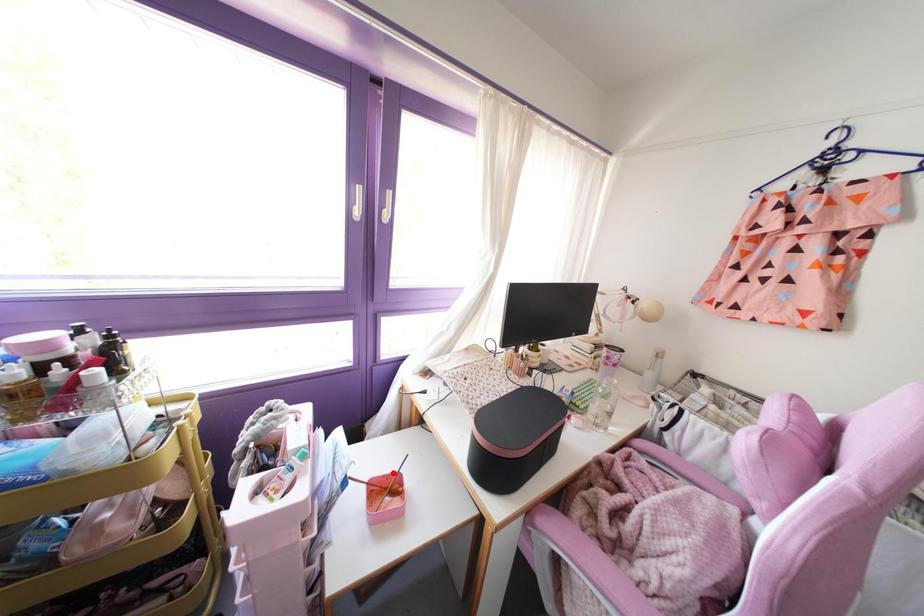
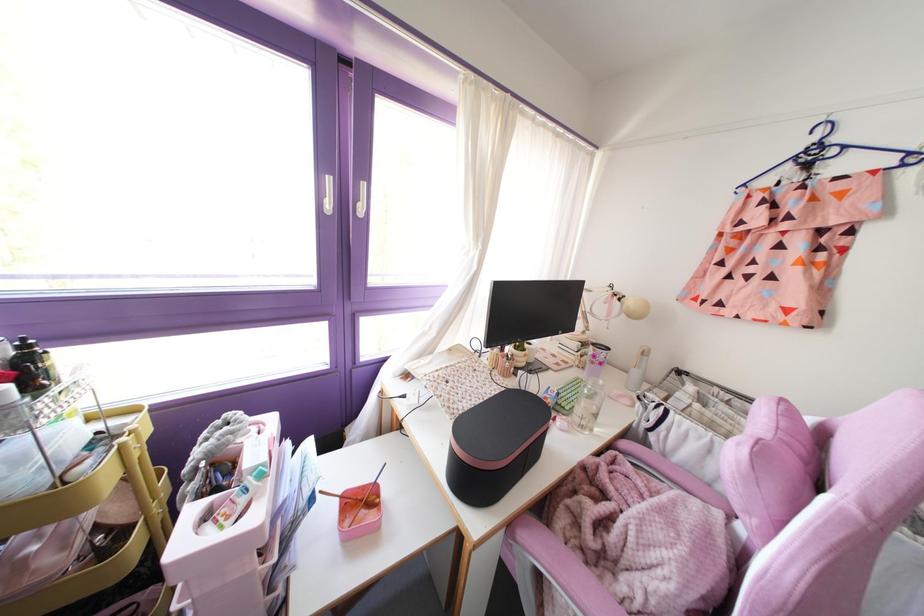
Question: I am providing you with two images of the same scene from different viewpoints. A red point is shown in image1. For the corresponding object point in image2, is it positioned nearer or farther from the camera?

Choices:
 (A) Nearer
 (B) Farther

Answer: (A)